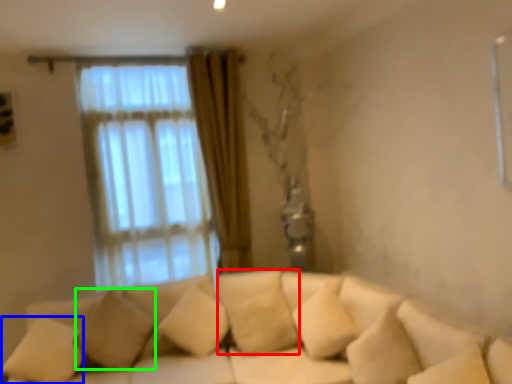
Question: Which object is the closest to the pillow (highlighted by a red box)? Choose among these: pillow (highlighted by a blue box) or pillow (highlighted by a green box).

Choices:
 (A) pillow
 (B) pillow

Answer: (B)